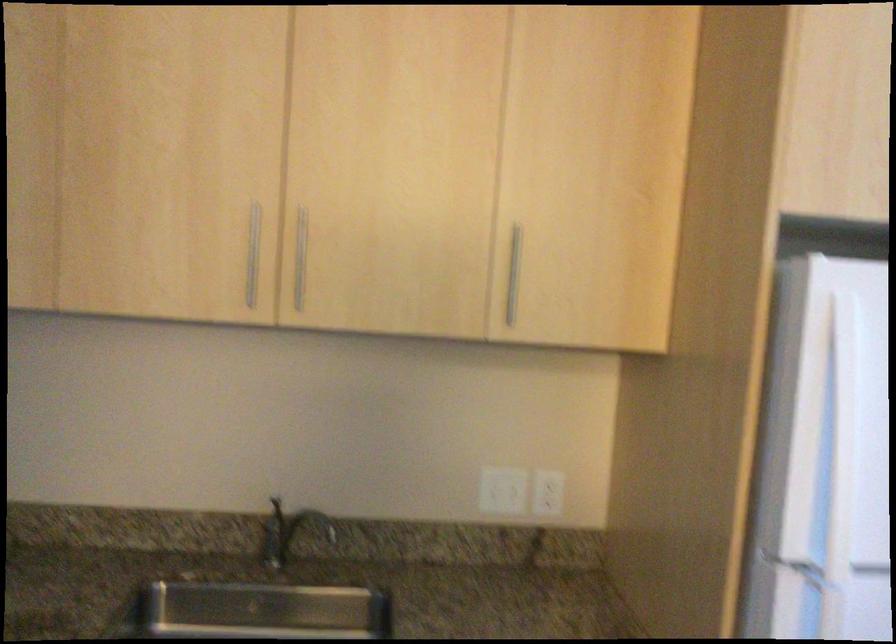
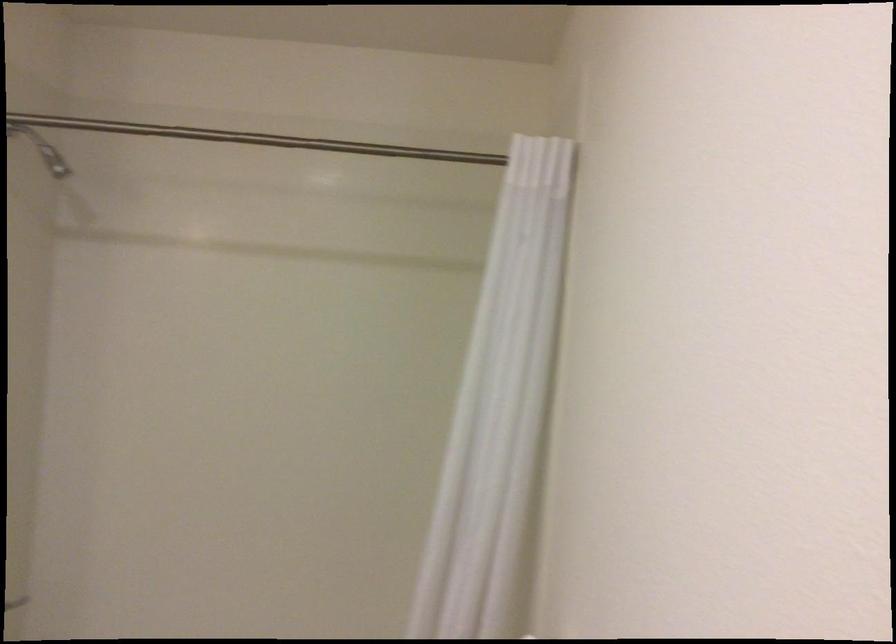
Question: The camera is either moving clockwise (left) or counter-clockwise (right) around the object. The first image is from the beginning of the video and the second image is from the end. Is the camera moving left or right when shooting the video?

Choices:
 (A) Left
 (B) Right

Answer: (B)